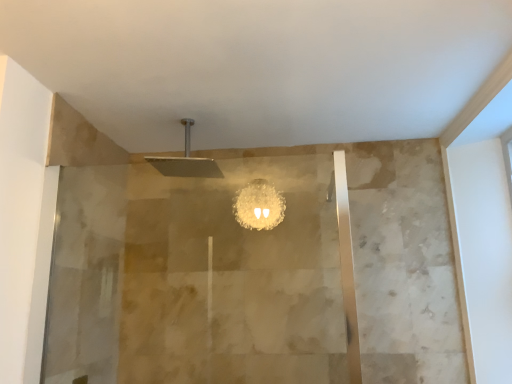
Question: From the image's perspective, is translucent glass screen door at left above or below matte silver shower head at upper center?

Choices:
 (A) above
 (B) below

Answer: (B)

Question: Considering the positions of point (62, 238) and point (176, 168), is point (62, 238) closer or farther from the camera than point (176, 168)?

Choices:
 (A) farther
 (B) closer

Answer: (B)

Question: Which is correct: translucent glass screen door at left is inside matte silver shower head at upper center, or outside of it?

Choices:
 (A) outside
 (B) inside

Answer: (A)

Question: In the image, is matte silver shower head at upper center on the left side or the right side of translucent glass screen door at left?

Choices:
 (A) right
 (B) left

Answer: (A)

Question: In terms of width, does matte silver shower head at upper center look wider or thinner when compared to translucent glass screen door at left?

Choices:
 (A) thin
 (B) wide

Answer: (B)

Question: Relative to translucent glass screen door at left, is matte silver shower head at upper center in front or behind?

Choices:
 (A) front
 (B) behind

Answer: (B)

Question: Looking at the image, does matte silver shower head at upper center seem bigger or smaller compared to translucent glass screen door at left?

Choices:
 (A) small
 (B) big

Answer: (A)